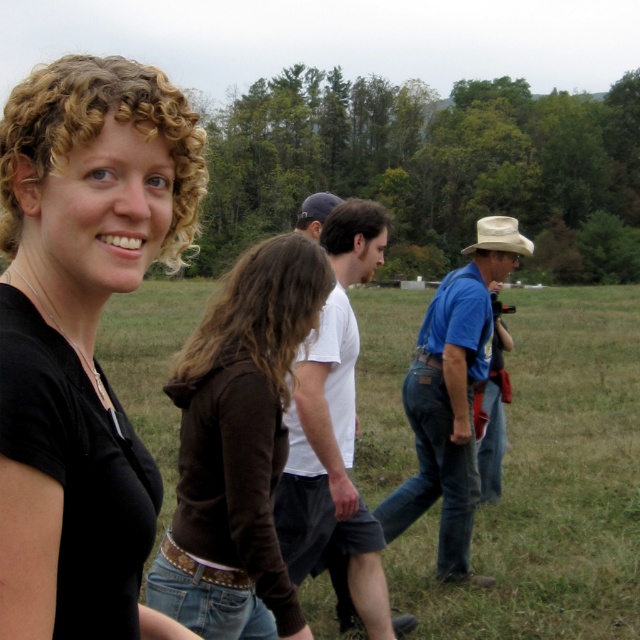
Question: Can you confirm if brown cotton shirt at center is positioned to the left of white cotton t-shirt at center?

Choices:
 (A) no
 (B) yes

Answer: (B)

Question: Which of these objects is positioned farthest from the white cotton t-shirt at center?

Choices:
 (A) black matte shirt at upper left
 (B) dark blue baseball cap at center

Answer: (B)

Question: Is black matte shirt at upper left to the left of dark blue baseball cap at center from the viewer's perspective?

Choices:
 (A) yes
 (B) no

Answer: (B)

Question: Does black matte shirt at upper left appear under blue denim jeans at right?

Choices:
 (A) no
 (B) yes

Answer: (A)

Question: Which point is closer to the camera taking this photo?

Choices:
 (A) (515, 244)
 (B) (275, 252)
 (C) (305, 220)
 (D) (438, 401)

Answer: (B)

Question: Which object is the farthest from the dark blue baseball cap at center?

Choices:
 (A) white cotton t-shirt at center
 (B) brown cotton shirt at center
 (C) black matte shirt at upper left

Answer: (B)